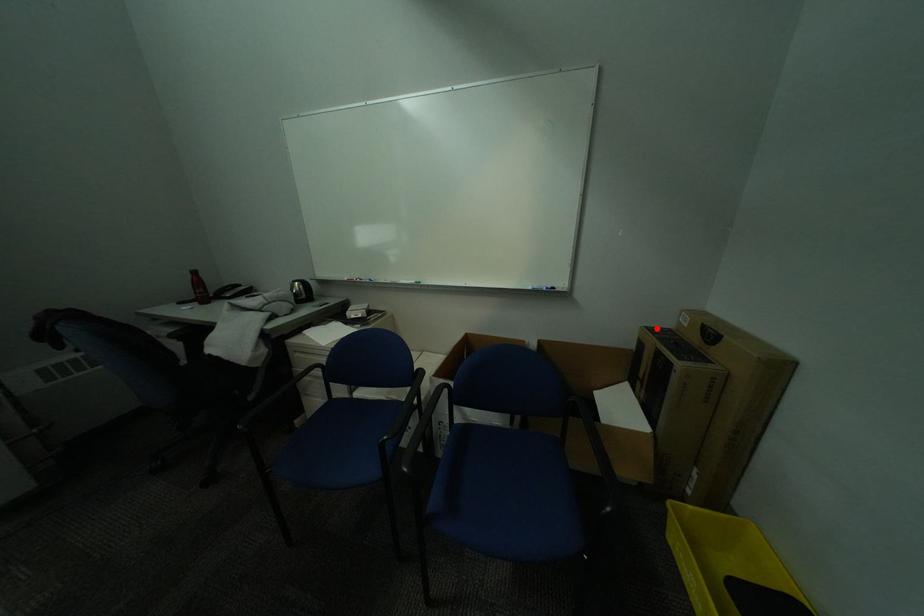
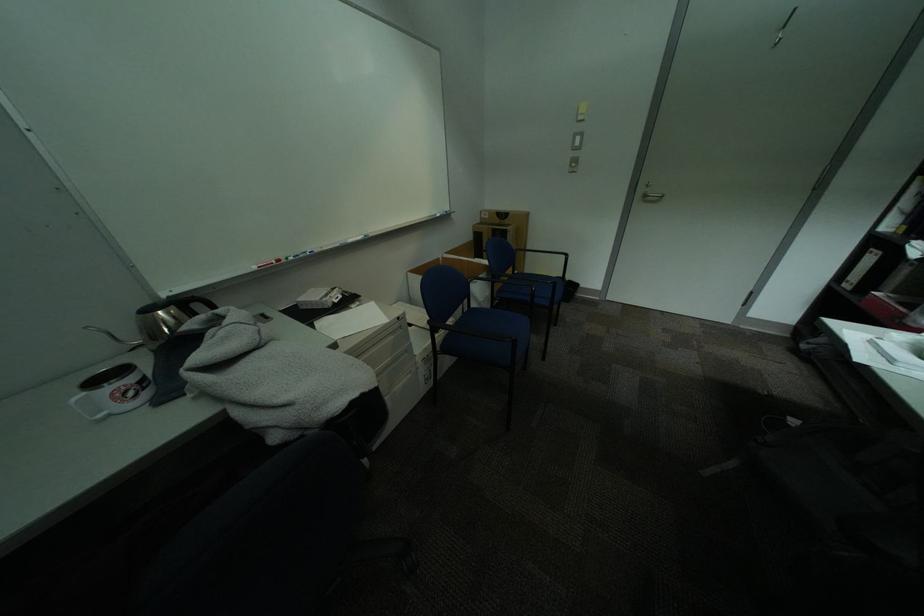
Question: I am providing you with two images of the same scene from different viewpoints. Image1 has a red point marked. In image2, the corresponding 3D location appears at what relative position? Reply with the corresponding letter.

Choices:
 (A) Closer
 (B) Farther

Answer: (A)